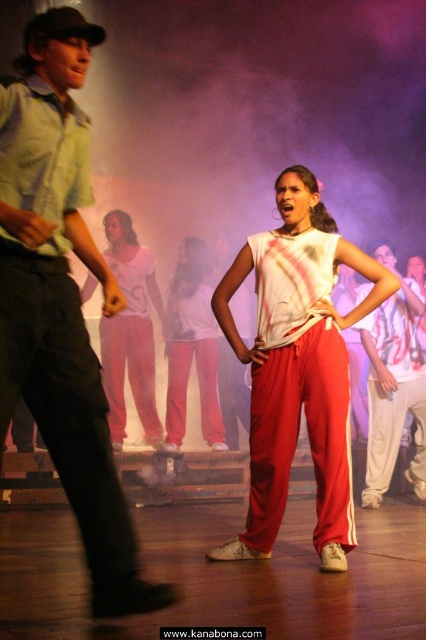
You are a stagehand setting up a spotlight. The spotlight can only be placed at point [129,332]. What object will be illuminated?

The white matte pants at center will be illuminated because they are located at point [129,332].

You are designing a stage layout and need to place two props. The brushed metal shirt at left and the white matte pants at center must be positioned such that the wider object is placed on the right side of the stage for balance. Which object should be placed on the right side?

The white matte pants at center should be placed on the right side of the stage because it has a greater width than the brushed metal shirt at left.